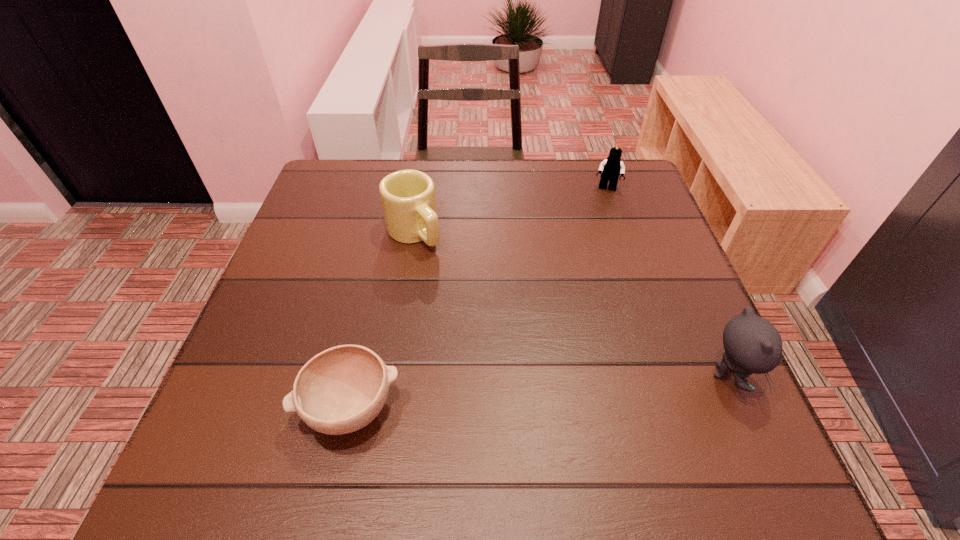
This screenshot has width=960, height=540. What are the coordinates of `vacant point that satisfies the following two spatial constraints: 1. on the front side of the third object from left to right; 2. on the front-facing side of the rightmost object` in the screenshot? It's located at (670, 375).

At what (x,y) coordinates should I click in order to perform the action: click on free spot that satisfies the following two spatial constraints: 1. on the front side of the rightmost object; 2. on the front-facing side of the second farthest object. Please return your answer as a coordinate pair (x, y). Looking at the image, I should click on (392, 375).

Where is `vacant space that satisfies the following two spatial constraints: 1. on the front side of the second farthest object; 2. on the front-facing side of the kitten`? Image resolution: width=960 pixels, height=540 pixels. vacant space that satisfies the following two spatial constraints: 1. on the front side of the second farthest object; 2. on the front-facing side of the kitten is located at coordinates (392, 375).

You are a GUI agent. You are given a task and a screenshot of the screen. Output one action in this format:
    pyautogui.click(x=<x>, y=<y>)
    Task: Click on the vacant space that satisfies the following two spatial constraints: 1. on the back side of the bowl; 2. on the front-facing side of the kitten
    
    Given the screenshot: What is the action you would take?
    pyautogui.click(x=358, y=375)

The height and width of the screenshot is (540, 960). In order to click on vacant point that satisfies the following two spatial constraints: 1. on the back side of the shortest object; 2. on the front-facing side of the kitten in this screenshot , I will do `click(358, 375)`.

I want to click on vacant point that satisfies the following two spatial constraints: 1. on the front side of the third nearest object; 2. on the front-facing side of the rightmost object, so click(392, 375).